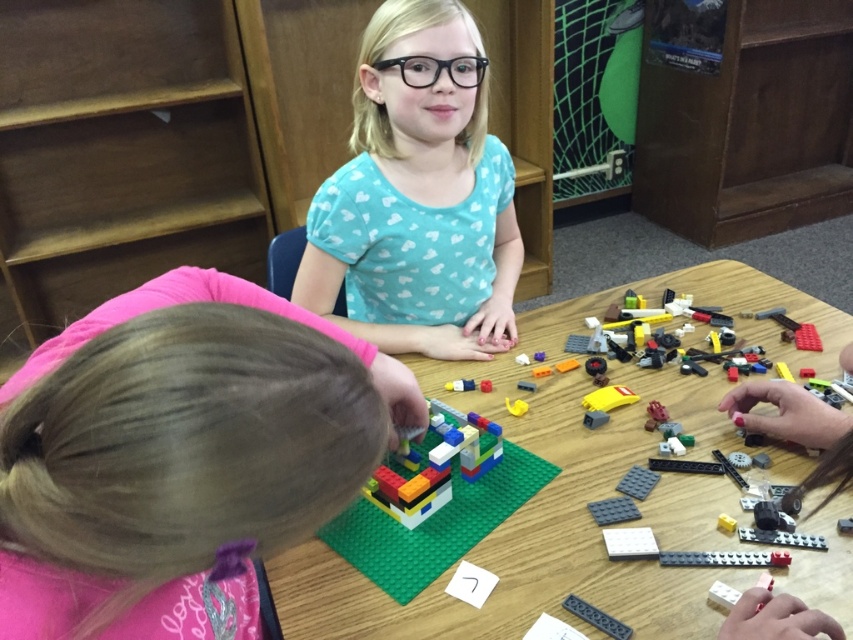
You are a child trying to build a tower using the multicolored plastic lego pieces at center and the translucent plastic lego at center. Which of these two LEGO sets will allow you to build a taller tower?

The multicolored plastic lego pieces at center is taller than the translucent plastic lego at center, so you can build a taller tower using the multicolored plastic lego pieces at center.

You are a child trying to build a tower with the multicolored plastic lego pieces at center and the translucent plastic lego at center. Which set of pieces do you think will allow you to build a taller tower?

The multicolored plastic lego pieces at center have a larger width than the translucent plastic lego at center, so they can stack more stably and build a taller tower.